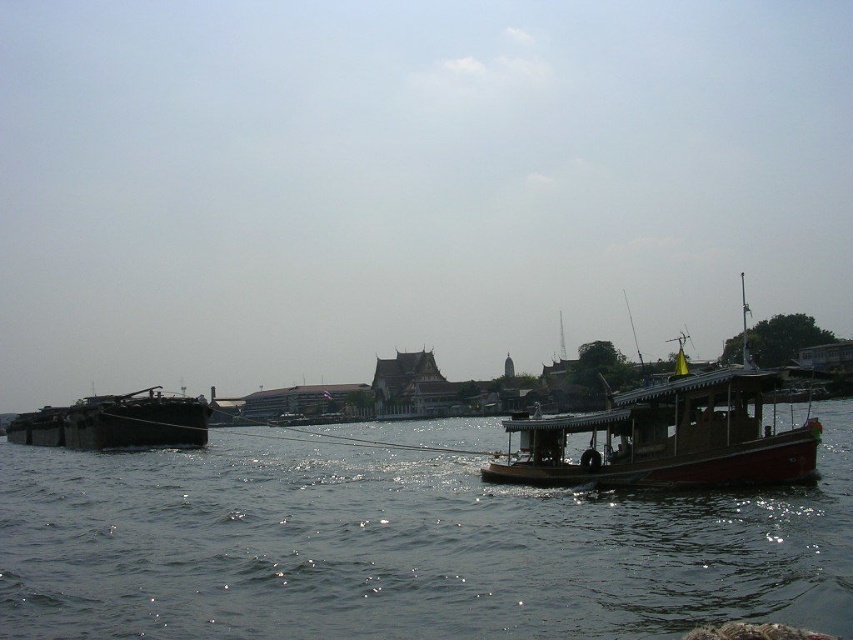
You are standing at the riverside and want to take a photo of the point at coordinates [257,438]. The camera you are using has a maximum focus range of 200 meters. Will the camera be able to focus on the point?

The distance of point [257,438] from the camera is 191.84 meters, which is within the camera maximum focus range of 200 meters. So yes, the camera will be able to focus on the point.

You are standing at the riverside and want to locate two specific points marked in the image. Which of the two points, point (317,484) or point (125,410), is closer to you?

Point (317,484) is closer to the viewer than point (125,410).

You are standing at the riverside and want to take a photo of the point at coordinate [155,609]. Your camera has a minimum focus distance of 150 feet. Will the camera be able to focus on the point?

The point at coordinate [155,609] is 154.62 feet away from the camera. Since this distance is greater than the camera minimum focus distance of 150 feet, the camera should be able to focus on the point.